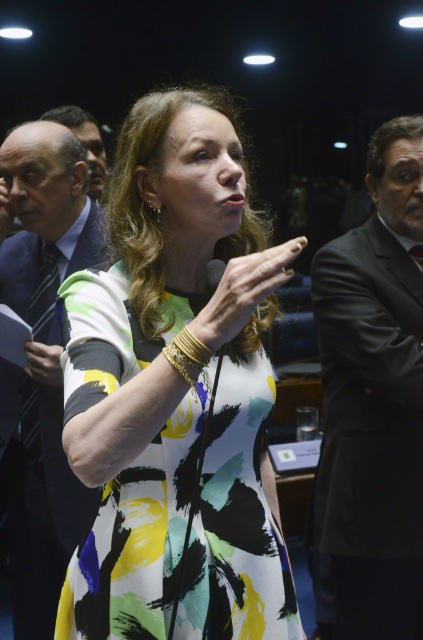
Who is shorter, dark blue suit at left or striped fabric tie at left?

Standing shorter between the two is striped fabric tie at left.

Which is in front, point (47, 160) or point (43, 310)?

Point (47, 160) is more forward.

Where is `dark blue suit at left`? Image resolution: width=423 pixels, height=640 pixels. dark blue suit at left is located at coordinates (43, 220).

You are a GUI agent. You are given a task and a screenshot of the screen. Output one action in this format:
    pyautogui.click(x=<x>, y=<y>)
    Task: Click on the dark blue suit at left
    This screenshot has height=640, width=423.
    Given the screenshot: What is the action you would take?
    coord(43,220)

Does point (183, 436) lie in front of point (211, 259)?

Yes, it is in front of point (211, 259).

Is printed fabric dress at center smaller than matte black microphone at center?

Incorrect, printed fabric dress at center is not smaller in size than matte black microphone at center.

This screenshot has width=423, height=640. In order to click on printed fabric dress at center in this screenshot , I will do `click(236, 522)`.

Between smooth skin hand at center and matte black microphone at center, which one has less height?

matte black microphone at center

Describe the element at coordinates (244, 291) in the screenshot. I see `smooth skin hand at center` at that location.

Does point (211, 316) come farther from viewer compared to point (211, 269)?

No, (211, 316) is in front of (211, 269).

Locate an element on the screen. smooth skin hand at center is located at coordinates (244, 291).